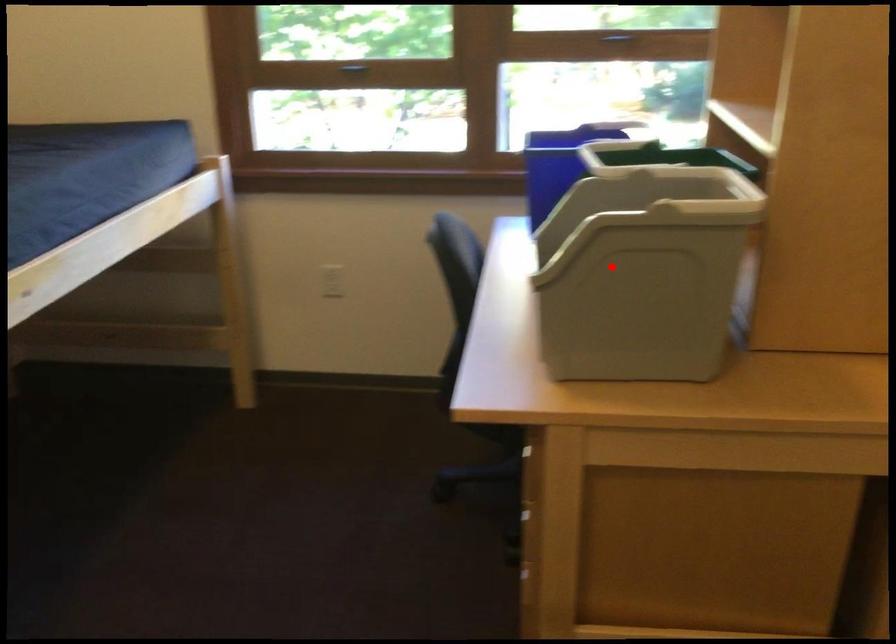
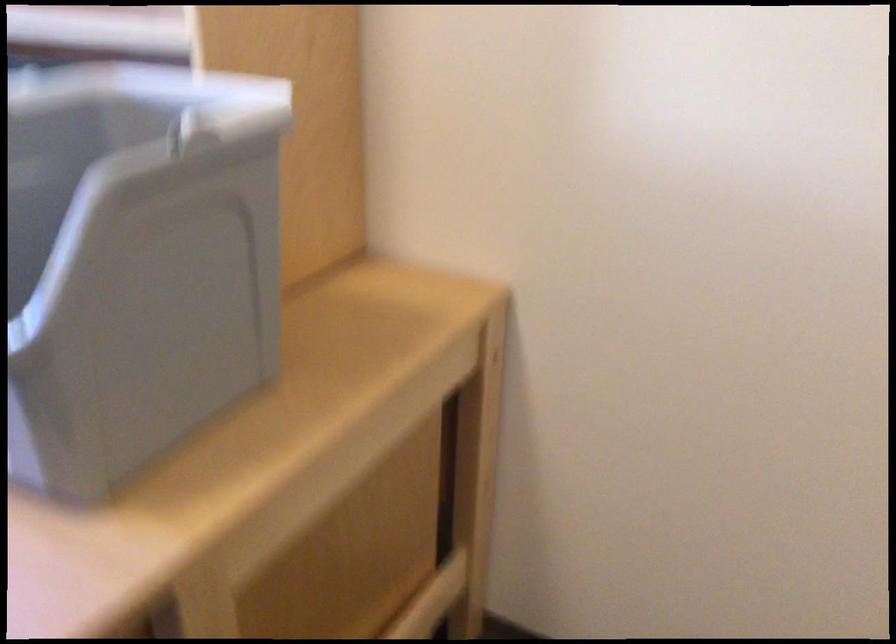
Question: I am providing you with two images of the same scene from different viewpoints. Given a red point in image1, look at the same physical point in image2. Is it:

Choices:
 (A) Closer to the viewpoint
 (B) Farther from the viewpoint

Answer: (A)